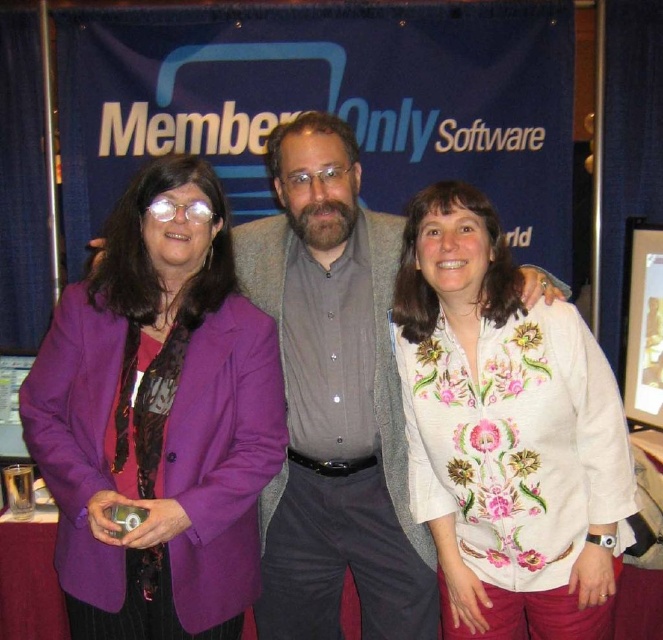
What do you see at coordinates (158, 419) in the screenshot? This screenshot has width=663, height=640. I see `purple fabric jacket at left` at bounding box center [158, 419].

The width and height of the screenshot is (663, 640). In order to click on purple fabric jacket at left in this screenshot , I will do `click(158, 419)`.

Which is below, purple fabric jacket at left or gray textured sweater at center?

gray textured sweater at center

From the picture: Does purple fabric jacket at left have a larger size compared to gray textured sweater at center?

No, purple fabric jacket at left is not bigger than gray textured sweater at center.

Is point (113, 467) farther from viewer compared to point (392, 404)?

No, (113, 467) is in front of (392, 404).

Find the location of `purple fabric jacket at left`. purple fabric jacket at left is located at coordinates (158, 419).

Is white floral blouse at center bigger than gray textured sweater at center?

Actually, white floral blouse at center might be smaller than gray textured sweater at center.

Which is behind, point (570, 445) or point (322, 566)?

The point (322, 566) is behind.

Locate an element on the screen. white floral blouse at center is located at coordinates (505, 433).